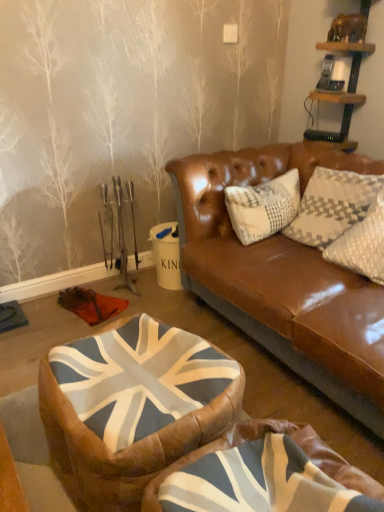
This screenshot has height=512, width=384. What do you see at coordinates (133, 406) in the screenshot?
I see `union jack fabric bean bag at center, which is the first bean bag chair from back to front` at bounding box center [133, 406].

Describe the element at coordinates (264, 474) in the screenshot. This screenshot has height=512, width=384. I see `union jack fabric bean bag at center, positioned as the 2th bean bag chair in back-to-front order` at that location.

The width and height of the screenshot is (384, 512). What are the coordinates of `wooden shelf at upper right` in the screenshot? It's located at (341, 95).

Between union jack fabric bean bag at center, which is the first bean bag chair from back to front, and union jack fabric bean bag at center, positioned as the 2th bean bag chair in back-to-front order, which one has larger size?

union jack fabric bean bag at center, which is the first bean bag chair from back to front.

Is the position of union jack fabric bean bag at center, which is the first bean bag chair from back to front, less distant than that of union jack fabric bean bag at center, positioned as the 2th bean bag chair in back-to-front order?

No, union jack fabric bean bag at center, which is the first bean bag chair from back to front, is further to the viewer.

Which of these two, union jack fabric bean bag at center, arranged as the 2th bean bag chair when viewed from the front, or union jack fabric bean bag at center, the first bean bag chair from the front, is wider?

With larger width is union jack fabric bean bag at center, the first bean bag chair from the front.

From the image's perspective, between union jack fabric bean bag at center, which is the first bean bag chair from back to front, and union jack fabric bean bag at center, positioned as the 2th bean bag chair in back-to-front order, which one is located above?

From the image's view, union jack fabric bean bag at center, which is the first bean bag chair from back to front, is above.

Does union jack fabric bean bag at center, the first bean bag chair from the front, have a smaller size compared to union jack fabric bean bag at center, which is the first bean bag chair from back to front?

Correct, union jack fabric bean bag at center, the first bean bag chair from the front, occupies less space than union jack fabric bean bag at center, which is the first bean bag chair from back to front.

From the image's perspective, is union jack fabric bean bag at center, positioned as the 2th bean bag chair in back-to-front order, positioned above or below union jack fabric bean bag at center, arranged as the 2th bean bag chair when viewed from the front?

union jack fabric bean bag at center, positioned as the 2th bean bag chair in back-to-front order, is situated lower than union jack fabric bean bag at center, arranged as the 2th bean bag chair when viewed from the front, in the image.

Between union jack fabric bean bag at center, the first bean bag chair from the front, and union jack fabric bean bag at center, arranged as the 2th bean bag chair when viewed from the front, which one is positioned behind?

union jack fabric bean bag at center, arranged as the 2th bean bag chair when viewed from the front, is behind.

Who is bigger, union jack fabric bean bag at center, which is the first bean bag chair from back to front, or wooden shelf at upper right?

union jack fabric bean bag at center, which is the first bean bag chair from back to front, is bigger.

Which of these two, union jack fabric bean bag at center, arranged as the 2th bean bag chair when viewed from the front, or wooden shelf at upper right, stands shorter?

union jack fabric bean bag at center, arranged as the 2th bean bag chair when viewed from the front, is shorter.

Can you confirm if union jack fabric bean bag at center, arranged as the 2th bean bag chair when viewed from the front, is positioned to the left of wooden shelf at upper right?

Yes, union jack fabric bean bag at center, arranged as the 2th bean bag chair when viewed from the front, is to the left of wooden shelf at upper right.

Based on the photo, which point is more forward, (133, 437) or (357, 70)?

The point (133, 437) is closer to the camera.

The image size is (384, 512). What are the coordinates of `the 1st bean bag chair below when counting from the wooden shelf at upper right (from the image's perspective)` in the screenshot? It's located at (133, 406).

Can we say wooden shelf at upper right lies outside union jack fabric bean bag at center, which is the first bean bag chair from back to front?

Yes, wooden shelf at upper right is not within union jack fabric bean bag at center, which is the first bean bag chair from back to front.

From the image's perspective, does wooden shelf at upper right appear lower than union jack fabric bean bag at center, arranged as the 2th bean bag chair when viewed from the front?

Incorrect, from the image's perspective, wooden shelf at upper right is higher than union jack fabric bean bag at center, arranged as the 2th bean bag chair when viewed from the front.

Is wooden shelf at upper right thinner than union jack fabric bean bag at center, which is the first bean bag chair from back to front?

Yes, wooden shelf at upper right is thinner than union jack fabric bean bag at center, which is the first bean bag chair from back to front.

From a real-world perspective, which is physically above, wooden shelf at upper right or union jack fabric bean bag at center, positioned as the 2th bean bag chair in back-to-front order?

From a 3D spatial view, wooden shelf at upper right is above.

Based on the photo, is wooden shelf at upper right next to union jack fabric bean bag at center, the first bean bag chair from the front, and touching it?

No, wooden shelf at upper right is not in contact with union jack fabric bean bag at center, the first bean bag chair from the front.

In the scene shown: Is wooden shelf at upper right smaller than union jack fabric bean bag at center, positioned as the 2th bean bag chair in back-to-front order?

Indeed, wooden shelf at upper right has a smaller size compared to union jack fabric bean bag at center, positioned as the 2th bean bag chair in back-to-front order.

Between wooden shelf at upper right and union jack fabric bean bag at center, positioned as the 2th bean bag chair in back-to-front order, which one has smaller width?

With smaller width is wooden shelf at upper right.

From a real-world perspective, is union jack fabric bean bag at center, the first bean bag chair from the front, located higher than wooden shelf at upper right?

No, from a real-world perspective, union jack fabric bean bag at center, the first bean bag chair from the front, is not over wooden shelf at upper right

Does union jack fabric bean bag at center, the first bean bag chair from the front, lie in front of wooden shelf at upper right?

Yes.

Is union jack fabric bean bag at center, the first bean bag chair from the front, bigger or smaller than wooden shelf at upper right?

In the image, union jack fabric bean bag at center, the first bean bag chair from the front, appears to be larger than wooden shelf at upper right.

Considering the relative positions of union jack fabric bean bag at center, the first bean bag chair from the front, and wooden shelf at upper right in the image provided, is union jack fabric bean bag at center, the first bean bag chair from the front, to the right of wooden shelf at upper right from the viewer's perspective?

In fact, union jack fabric bean bag at center, the first bean bag chair from the front, is to the left of wooden shelf at upper right.

Find the location of `bean bag chair that is behind the union jack fabric bean bag at center, positioned as the 2th bean bag chair in back-to-front order`. bean bag chair that is behind the union jack fabric bean bag at center, positioned as the 2th bean bag chair in back-to-front order is located at coordinates (133, 406).

Identify the location of bean bag chair below the union jack fabric bean bag at center, arranged as the 2th bean bag chair when viewed from the front (from the image's perspective). click(264, 474).

Considering their positions, is wooden shelf at upper right positioned further to union jack fabric bean bag at center, arranged as the 2th bean bag chair when viewed from the front, than union jack fabric bean bag at center, positioned as the 2th bean bag chair in back-to-front order?

wooden shelf at upper right.

Based on their spatial positions, is union jack fabric bean bag at center, positioned as the 2th bean bag chair in back-to-front order, or union jack fabric bean bag at center, which is the first bean bag chair from back to front, further from wooden shelf at upper right?

The object further to wooden shelf at upper right is union jack fabric bean bag at center, positioned as the 2th bean bag chair in back-to-front order.

Estimate the real-world distances between objects in this image. Which object is further from union jack fabric bean bag at center, arranged as the 2th bean bag chair when viewed from the front, union jack fabric bean bag at center, positioned as the 2th bean bag chair in back-to-front order, or wooden shelf at upper right?

The object further to union jack fabric bean bag at center, arranged as the 2th bean bag chair when viewed from the front, is wooden shelf at upper right.

When comparing their distances from union jack fabric bean bag at center, the first bean bag chair from the front, does wooden shelf at upper right or union jack fabric bean bag at center, which is the first bean bag chair from back to front, seem further?

Based on the image, wooden shelf at upper right appears to be further to union jack fabric bean bag at center, the first bean bag chair from the front.

Looking at this image, when comparing their distances from union jack fabric bean bag at center, the first bean bag chair from the front, does union jack fabric bean bag at center, which is the first bean bag chair from back to front, or wooden shelf at upper right seem closer?

The object closer to union jack fabric bean bag at center, the first bean bag chair from the front, is union jack fabric bean bag at center, which is the first bean bag chair from back to front.

Which object lies nearer to the anchor point wooden shelf at upper right, union jack fabric bean bag at center, which is the first bean bag chair from back to front, or union jack fabric bean bag at center, positioned as the 2th bean bag chair in back-to-front order?

union jack fabric bean bag at center, which is the first bean bag chair from back to front.

You are a GUI agent. You are given a task and a screenshot of the screen. Output one action in this format:
    pyautogui.click(x=<x>, y=<y>)
    Task: Click on the bean bag chair between wooden shelf at upper right and union jack fabric bean bag at center, positioned as the 2th bean bag chair in back-to-front order, from top to bottom
    Image resolution: width=384 pixels, height=512 pixels.
    Given the screenshot: What is the action you would take?
    pyautogui.click(x=133, y=406)